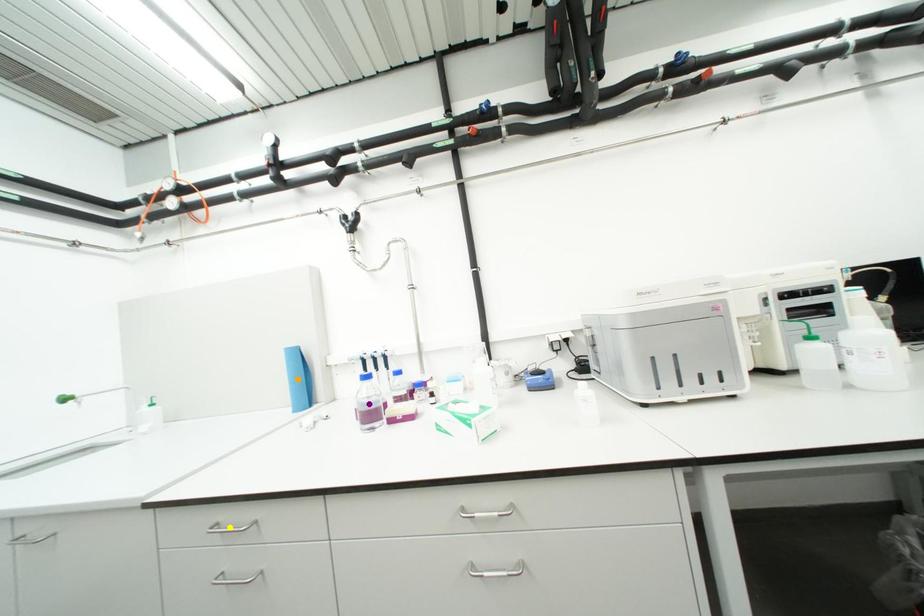
Order these from nearest to farthest:
1. orange point
2. purple point
3. yellow point

yellow point, purple point, orange point